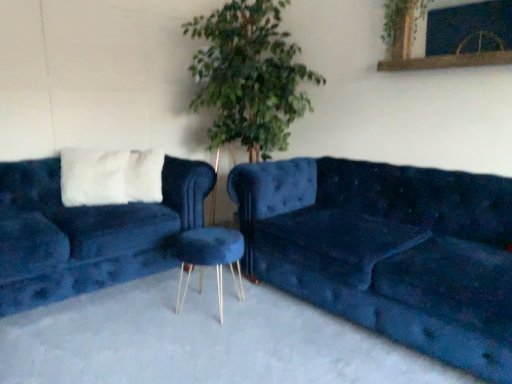
This screenshot has height=384, width=512. What are the coordinates of `free space in front of velvet blue stool at center` in the screenshot? It's located at (203, 334).